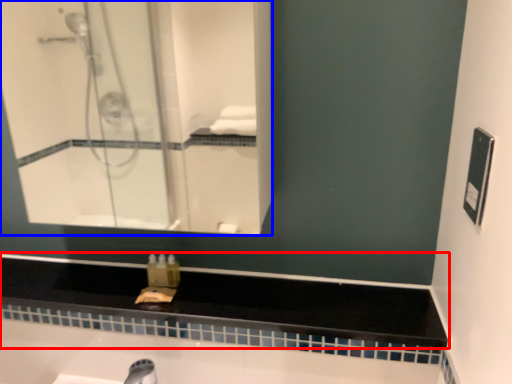
Question: Which of the following is the closest to the observer, counter top (highlighted by a red box) or mirror (highlighted by a blue box)?

Choices:
 (A) counter top
 (B) mirror

Answer: (B)